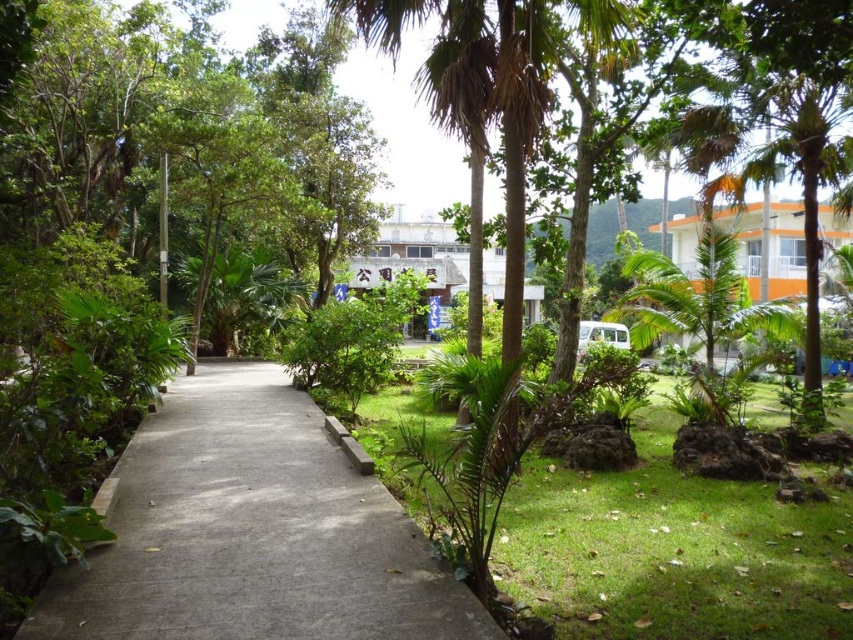
What do you see at coordinates (672, 550) in the screenshot? The height and width of the screenshot is (640, 853). I see `green grass at center` at bounding box center [672, 550].

Does point (524, 560) lie behind point (688, 288)?

No, it is not.

Does point (625, 589) lie in front of point (666, 305)?

Yes.

Locate an element on the screen. green grass at center is located at coordinates (x=672, y=550).

Does green grass at center come behind green leafy palm tree at center?

No, green grass at center is in front of green leafy palm tree at center.

Which is behind, point (619, 595) or point (537, 52)?

The point (537, 52) is behind.

At what (x,y) coordinates should I click in order to perform the action: click on green grass at center. Please return your answer as a coordinate pair (x, y). The height and width of the screenshot is (640, 853). Looking at the image, I should click on (672, 550).

This screenshot has height=640, width=853. What do you see at coordinates (252, 532) in the screenshot?
I see `gray concrete pavement at center` at bounding box center [252, 532].

Between gray concrete pavement at center and green leafy palm tree at center, which one is positioned lower?

gray concrete pavement at center is lower down.

Who is more distant from viewer, (376, 554) or (514, 68)?

Point (514, 68)

The image size is (853, 640). I want to click on gray concrete pavement at center, so click(x=252, y=532).